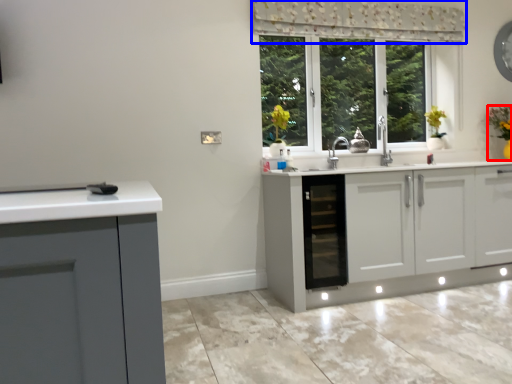
Question: Which object is further to the camera taking this photo, houseplant (highlighted by a red box) or curtain (highlighted by a blue box)?

Choices:
 (A) houseplant
 (B) curtain

Answer: (A)